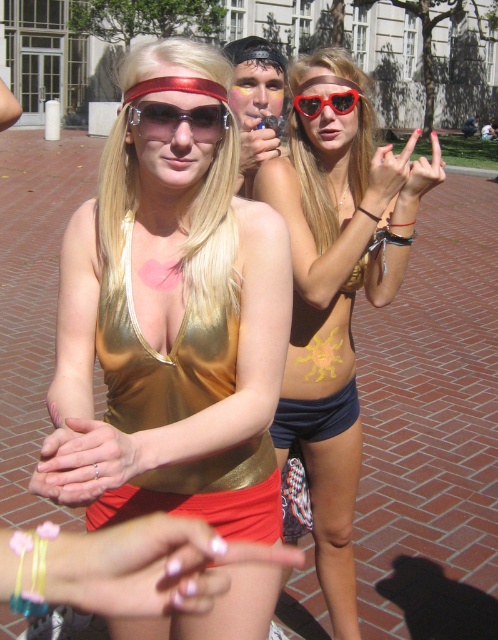
Question: Which of the following is the farthest from the observer?

Choices:
 (A) matte gold bikini top at center
 (B) metallic gold goggles at upper center
 (C) red plastic sunglasses at upper center
 (D) gold shiny dress at center

Answer: (C)

Question: Is gold shiny dress at center positioned before red plastic sunglasses at upper center?

Choices:
 (A) no
 (B) yes

Answer: (B)

Question: Does gold shiny dress at center appear under red plastic sunglasses at upper center?

Choices:
 (A) yes
 (B) no

Answer: (A)

Question: Which point is closer to the camera?

Choices:
 (A) gold shiny tank top at center
 (B) gold shiny dress at center
 (C) matte gold bikini top at center

Answer: (A)

Question: Which of the following is the closest to the observer?

Choices:
 (A) metallic gold goggles at upper center
 (B) red plastic sunglasses at upper center

Answer: (A)

Question: Is gold shiny dress at center closer to the viewer compared to metallic gold goggles at upper center?

Choices:
 (A) no
 (B) yes

Answer: (B)